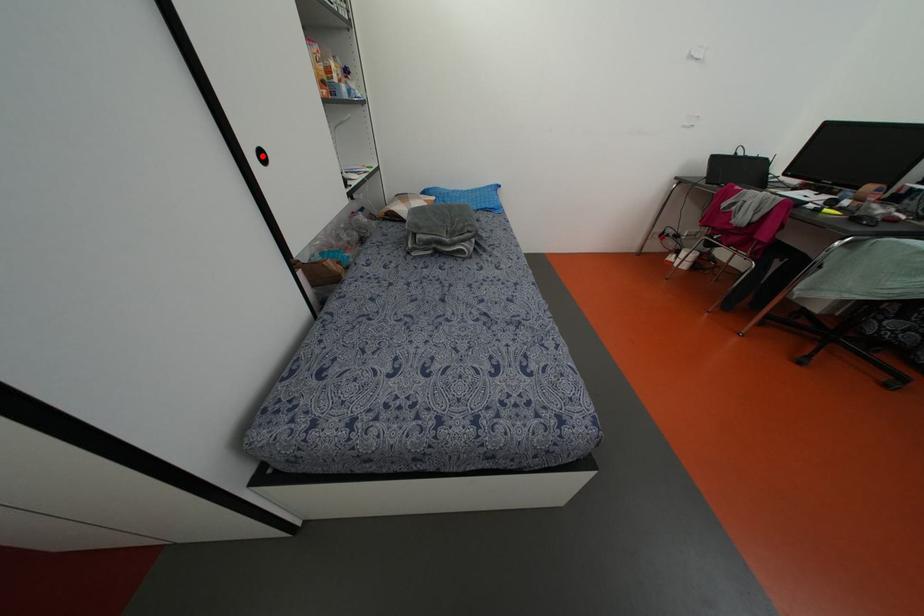
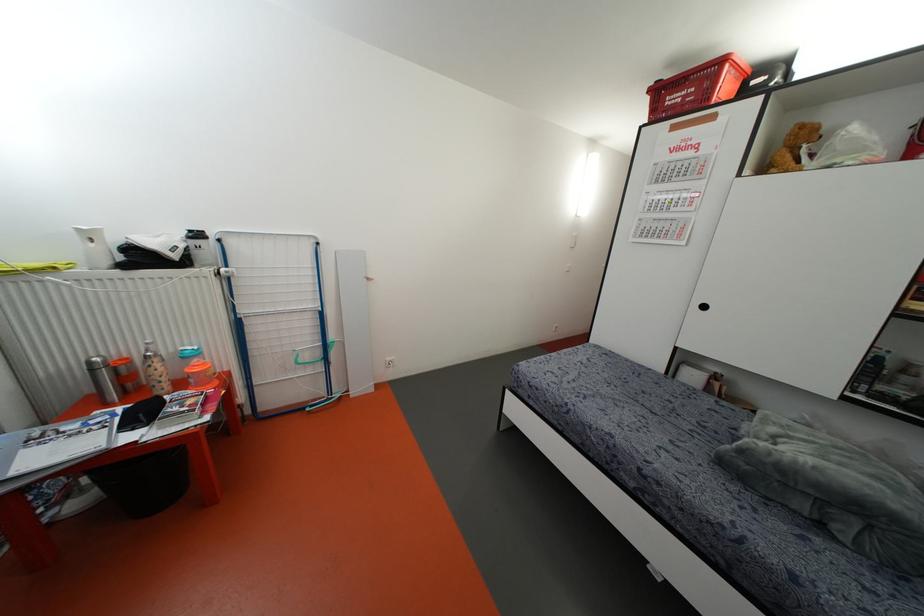
Find the pixel in the second image that matches the highlighted location in the first image.

(703, 307)